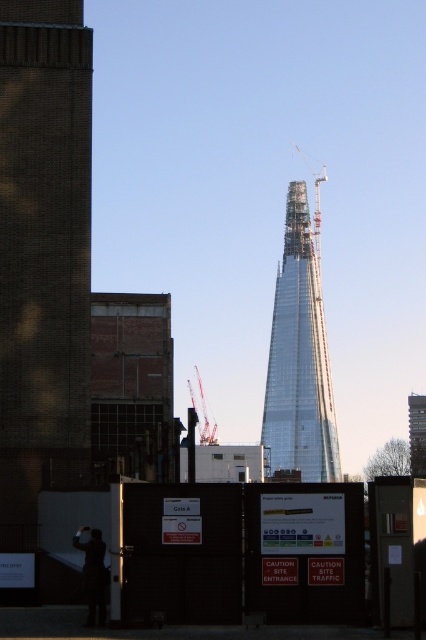
Which is more to the right, glassy steel tower at center or dark matte jacket at lower left?

glassy steel tower at center is more to the right.

This screenshot has width=426, height=640. Describe the element at coordinates (299, 358) in the screenshot. I see `glassy steel tower at center` at that location.

What are the coordinates of `glassy steel tower at center` in the screenshot? It's located at (299, 358).

Is point (39, 150) behind point (313, 248)?

No, (39, 150) is closer to viewer.

Who is positioned more to the left, brick wall at left or metallic construction crane at upper center?

brick wall at left

Does point (72, 266) lie behind point (305, 157)?

No, (72, 266) is in front of (305, 157).

This screenshot has height=640, width=426. Identify the location of brick wall at left. (43, 257).

Between brick wall at left and metallic gray crane at center, which one appears on the left side from the viewer's perspective?

metallic gray crane at center

Is brick wall at left wider than metallic gray crane at center?

No, brick wall at left is not wider than metallic gray crane at center.

Who is more distant from viewer, [19,154] or [204,426]?

The point [204,426] is behind.

You are a GUI agent. You are given a task and a screenshot of the screen. Output one action in this format:
    pyautogui.click(x=<x>, y=<y>)
    Task: Click on the brick wall at left
    This screenshot has height=640, width=426.
    Given the screenshot: What is the action you would take?
    pyautogui.click(x=43, y=257)